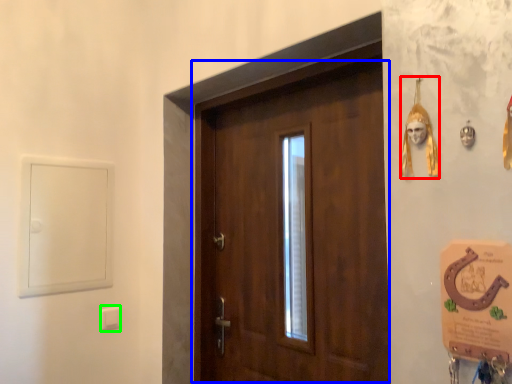
Question: Which object is positioned closest to decor (highlighted by a red box)? Select from door (highlighted by a blue box) and light switch (highlighted by a green box).

Choices:
 (A) door
 (B) light switch

Answer: (A)